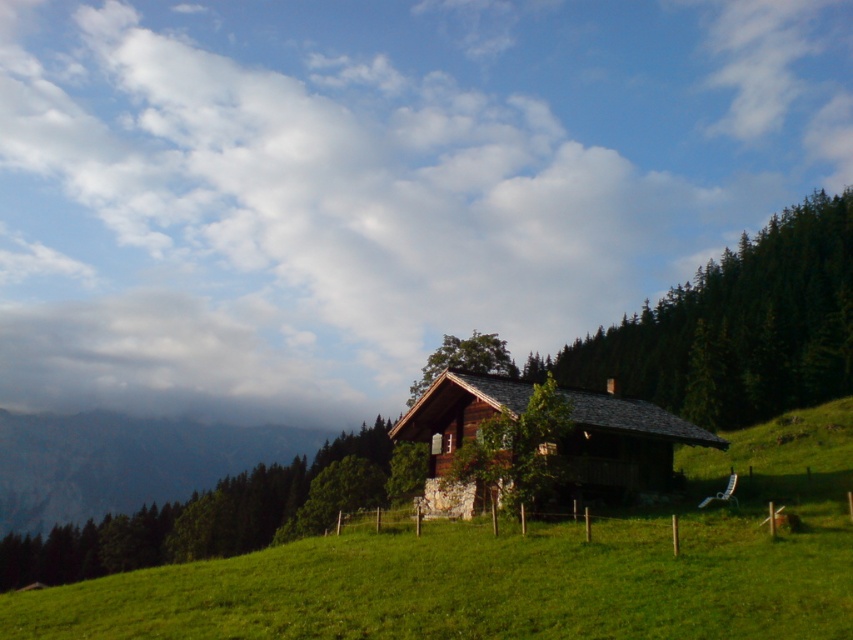
Is white fluffy cloud at upper center taller than green grassy field at center?

Yes, white fluffy cloud at upper center is taller than green grassy field at center.

Is white fluffy cloud at upper center positioned before green grassy field at center?

That is False.

Is point (729, 230) behind point (850, 614)?

Yes, it is.

Identify the location of white fluffy cloud at upper center. This screenshot has height=640, width=853. (376, 182).

Is white fluffy cloud at upper center smaller than wooden log cabin at center?

Actually, white fluffy cloud at upper center might be larger than wooden log cabin at center.

Can you confirm if white fluffy cloud at upper center is positioned to the right of wooden log cabin at center?

In fact, white fluffy cloud at upper center is to the left of wooden log cabin at center.

Locate an element on the screen. The width and height of the screenshot is (853, 640). white fluffy cloud at upper center is located at coordinates (376, 182).

Where is `white fluffy cloud at upper center`? The height and width of the screenshot is (640, 853). white fluffy cloud at upper center is located at coordinates (376, 182).

Is green grassy field at center bigger than wooden log cabin at center?

Yes.

Does green grassy field at center have a smaller size compared to wooden log cabin at center?

No.

Find the location of a particular element. This screenshot has height=640, width=853. green grassy field at center is located at coordinates (521, 568).

Identify the location of green grassy field at center. The image size is (853, 640). (521, 568).